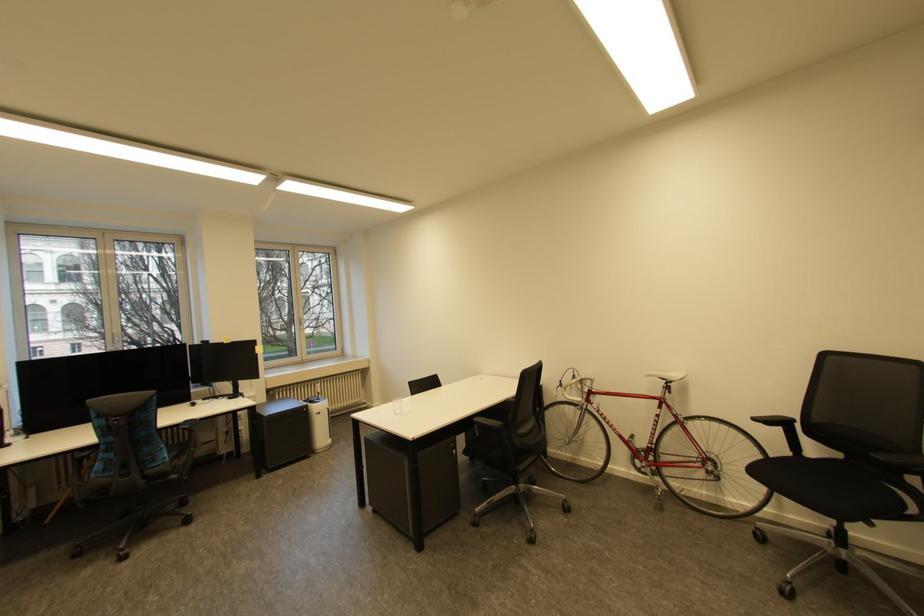
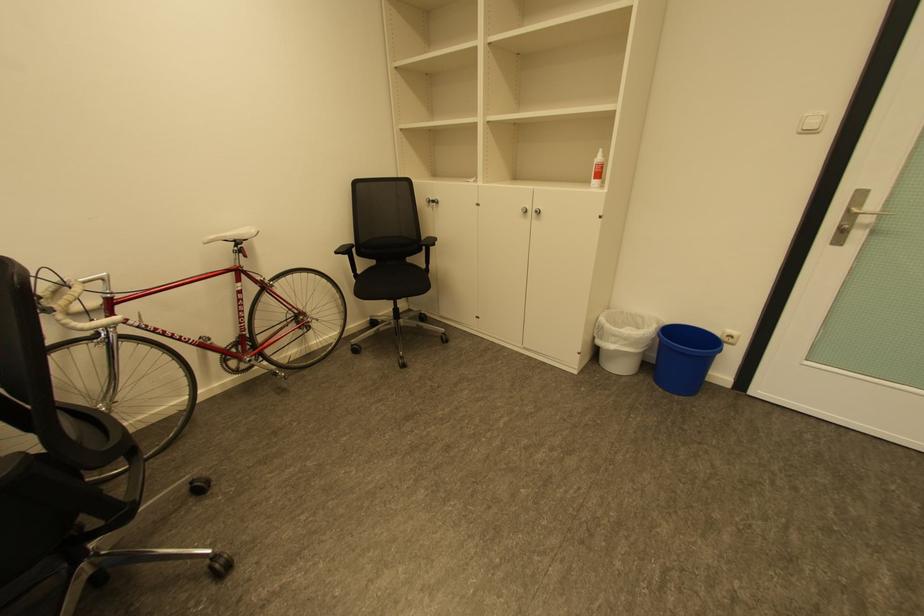
Where in the second image is the point corresponding to [761,419] from the first image?

(344, 253)